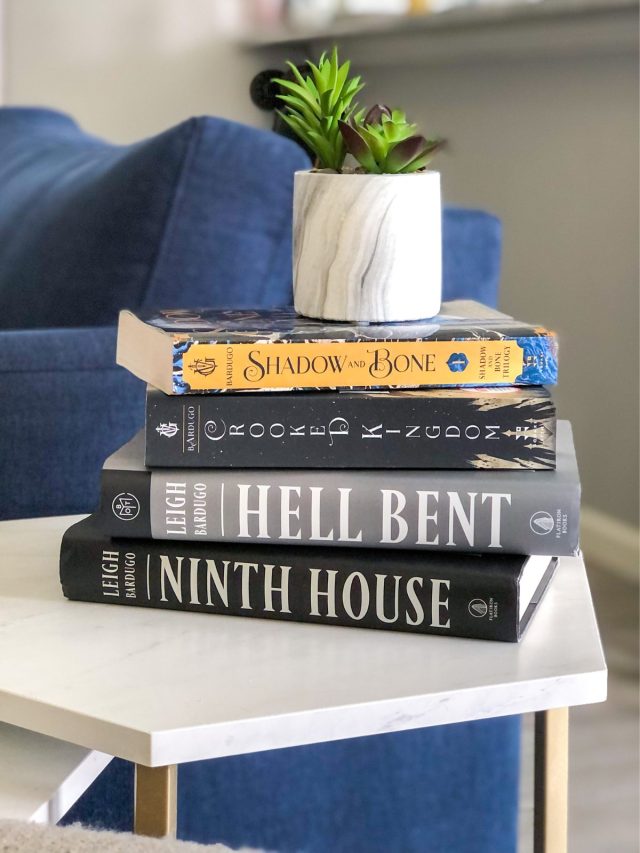
At what (x,y) coordinates should I click in order to perform the action: click on wooden column. Please return your answer as a coordinate pair (x, y). The image size is (640, 853). Looking at the image, I should click on tap(154, 813).